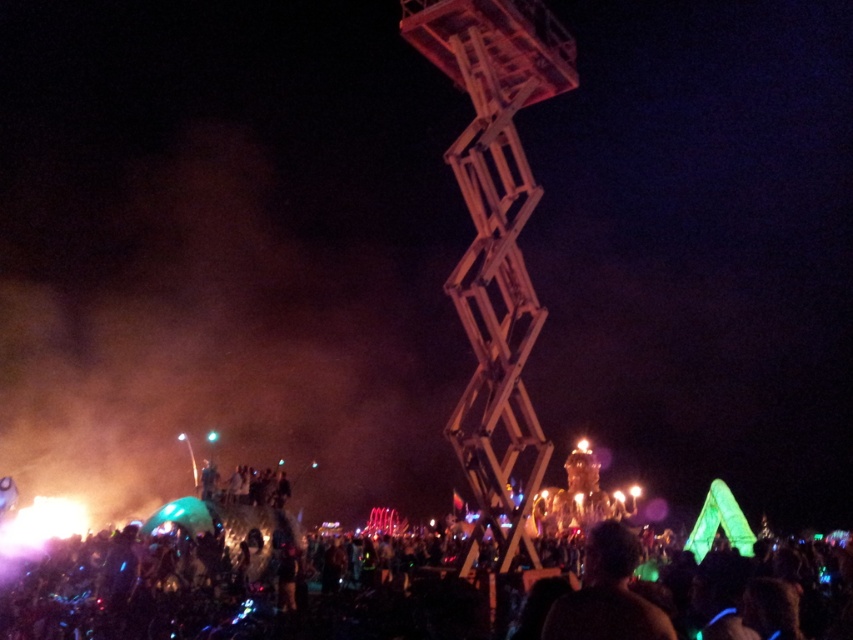
Question: Does black matte crowd at lower center have a smaller size compared to black matte person at lower center?

Choices:
 (A) no
 (B) yes

Answer: (A)

Question: In this image, where is black matte crowd at lower center located relative to wooden at center?

Choices:
 (A) below
 (B) above

Answer: (A)

Question: Among these points, which one is nearest to the camera?

Choices:
 (A) (103, 625)
 (B) (637, 636)
 (C) (239, 500)

Answer: (B)

Question: Which object is the farthest from the wooden at center?

Choices:
 (A) black matte crowd at lower center
 (B) dark skin textured crowd at lower center

Answer: (B)

Question: Which object is farther from the camera taking this photo?

Choices:
 (A) dark skin textured crowd at lower center
 (B) wooden at center

Answer: (A)

Question: Is black matte crowd at lower center in front of wooden at center?

Choices:
 (A) yes
 (B) no

Answer: (A)